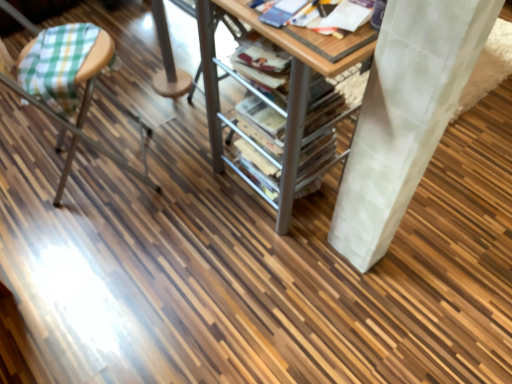
Question: Is wooden table at center in front of or behind green plaid fabric stool at left in the image?

Choices:
 (A) behind
 (B) front

Answer: (B)

Question: From the image's perspective, is wooden table at center positioned above or below green plaid fabric stool at left?

Choices:
 (A) above
 (B) below

Answer: (A)

Question: Is wooden table at center spatially inside green plaid fabric stool at left, or outside of it?

Choices:
 (A) outside
 (B) inside

Answer: (A)

Question: Which is correct: green plaid fabric stool at left is inside wooden table at center, or outside of it?

Choices:
 (A) outside
 (B) inside

Answer: (A)

Question: From a real-world perspective, is green plaid fabric stool at left physically located above or below wooden table at center?

Choices:
 (A) above
 (B) below

Answer: (A)

Question: Is green plaid fabric stool at left taller or shorter than wooden table at center?

Choices:
 (A) tall
 (B) short

Answer: (A)

Question: Considering the relative positions of green plaid fabric stool at left and wooden table at center in the image provided, is green plaid fabric stool at left to the left or to the right of wooden table at center?

Choices:
 (A) right
 (B) left

Answer: (B)